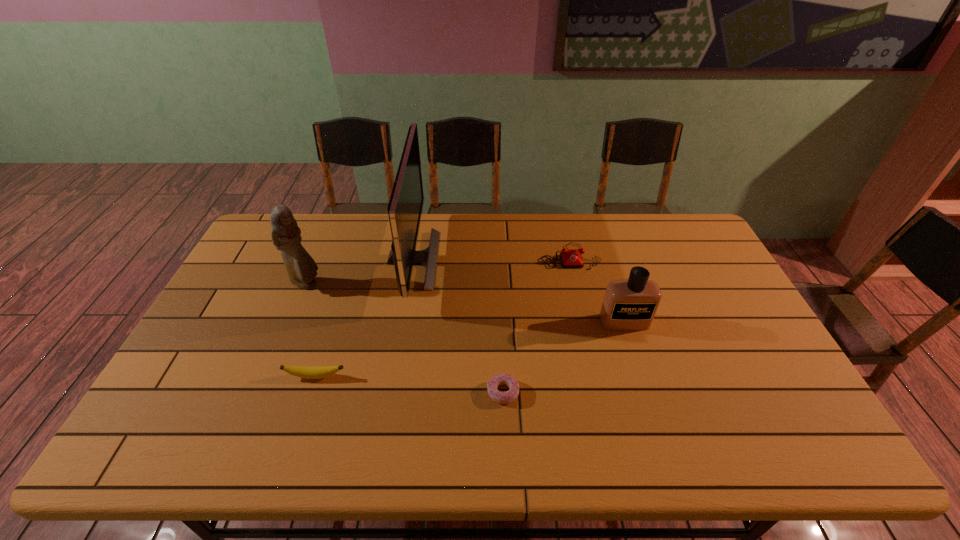
In the image, there is a desktop. Where is `vacant space at the near left corner`? vacant space at the near left corner is located at coordinates coord(199,450).

Identify the location of vacant space at the far right corner of the desktop. This screenshot has width=960, height=540. (661, 222).

Locate an element on the screen. The height and width of the screenshot is (540, 960). free point between the second tallest object and the fourth tallest object is located at coordinates (438, 270).

Find the location of a particular element. The height and width of the screenshot is (540, 960). free space between the second shortest object and the fourth tallest object is located at coordinates (443, 316).

Identify the location of free space between the fifth shortest object and the monitor. (359, 272).

The height and width of the screenshot is (540, 960). Identify the location of free space between the second tallest object and the banana. [311, 330].

Where is `empty location between the fourth object from right to left and the doughnut`? Image resolution: width=960 pixels, height=540 pixels. empty location between the fourth object from right to left and the doughnut is located at coordinates (458, 326).

The height and width of the screenshot is (540, 960). I want to click on blank region between the fourth tallest object and the monitor, so click(491, 258).

This screenshot has width=960, height=540. What are the coordinates of `free space that is in between the monitor and the shortest object` in the screenshot? It's located at (458, 326).

The height and width of the screenshot is (540, 960). I want to click on free spot between the banana and the figurine, so click(x=311, y=330).